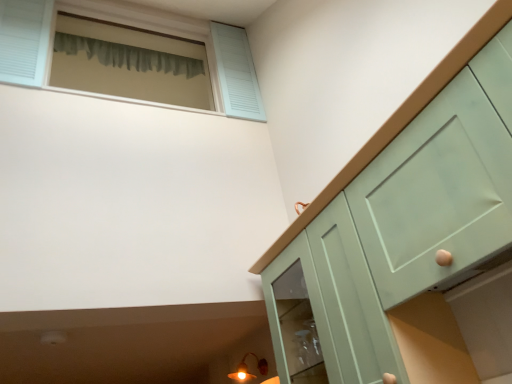
Question: Is matte green cabinet at lower right smaller than mint green cabinet at right?

Choices:
 (A) no
 (B) yes

Answer: (B)

Question: From a real-world perspective, is matte green cabinet at lower right positioned under mint green cabinet at right based on gravity?

Choices:
 (A) no
 (B) yes

Answer: (A)

Question: Does matte green cabinet at lower right touch mint green cabinet at right?

Choices:
 (A) no
 (B) yes

Answer: (A)

Question: Considering the relative sizes of matte green cabinet at lower right and mint green cabinet at right in the image provided, is matte green cabinet at lower right bigger than mint green cabinet at right?

Choices:
 (A) no
 (B) yes

Answer: (A)

Question: Could you tell me if matte green cabinet at lower right is turned towards mint green cabinet at right?

Choices:
 (A) yes
 (B) no

Answer: (B)

Question: Is matte green cabinet at lower right behind mint green cabinet at right?

Choices:
 (A) no
 (B) yes

Answer: (B)

Question: Is light blue wooden window at upper left located outside green fabric curtain at upper left?

Choices:
 (A) no
 (B) yes

Answer: (B)

Question: From a real-world perspective, is light blue wooden window at upper left positioned under green fabric curtain at upper left based on gravity?

Choices:
 (A) no
 (B) yes

Answer: (B)

Question: Is light blue wooden window at upper left positioned in front of green fabric curtain at upper left?

Choices:
 (A) yes
 (B) no

Answer: (A)

Question: Considering the relative sizes of light blue wooden window at upper left and green fabric curtain at upper left in the image provided, is light blue wooden window at upper left bigger than green fabric curtain at upper left?

Choices:
 (A) no
 (B) yes

Answer: (B)

Question: Does light blue wooden window at upper left appear on the left side of green fabric curtain at upper left?

Choices:
 (A) no
 (B) yes

Answer: (A)

Question: Can you confirm if light blue wooden window at upper left is thinner than green fabric curtain at upper left?

Choices:
 (A) yes
 (B) no

Answer: (B)

Question: Is matte gold light fixture at lower left smaller than mint green cabinet at right?

Choices:
 (A) yes
 (B) no

Answer: (A)